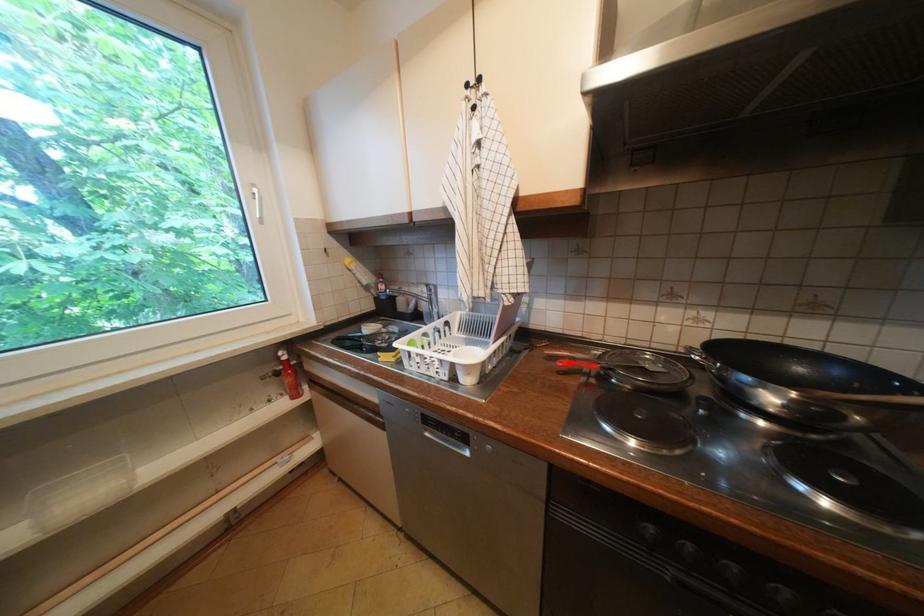
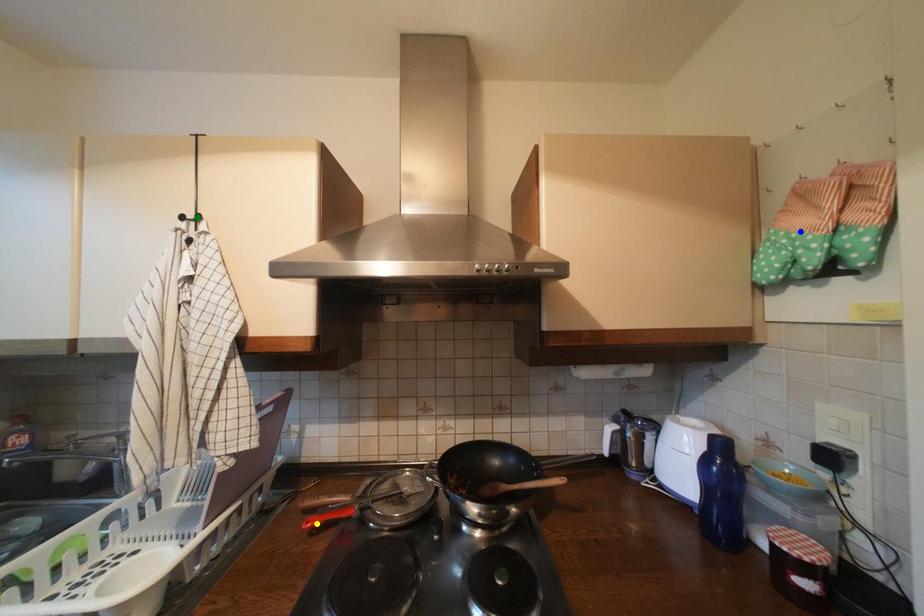
Question: I am providing you with two images of the same scene from different viewpoints. A red point is marked on the first image. You are given multiple points on the second image. Which point in image 2 is actually the same real-world point as the red point in image 1?

Choices:
 (A) yellow point
 (B) blue point
 (C) green point

Answer: (A)